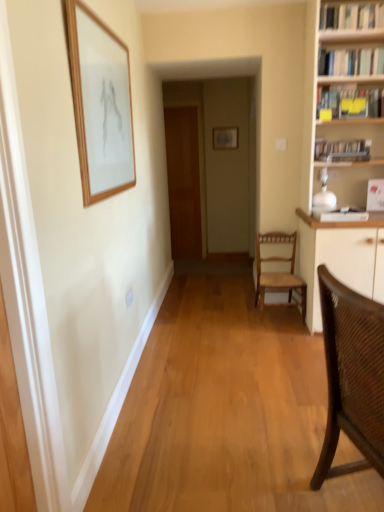
Question: Considering the relative positions of white glossy bookshelf at upper right, which ranks as the fourth book in bottom-to-top order, and brown woven chair at right, which ranks as the 1th chair in front-to-back order, in the image provided, is white glossy bookshelf at upper right, which ranks as the fourth book in bottom-to-top order, to the right of brown woven chair at right, which ranks as the 1th chair in front-to-back order, from the viewer's perspective?

Choices:
 (A) yes
 (B) no

Answer: (A)

Question: Is white glossy bookshelf at upper right, which ranks as the fourth book in bottom-to-top order, oriented away from brown woven chair at right, the second chair viewed from the back?

Choices:
 (A) yes
 (B) no

Answer: (B)

Question: Does white glossy bookshelf at upper right, which ranks as the fourth book in bottom-to-top order, have a lesser height compared to brown woven chair at right, the second chair viewed from the back?

Choices:
 (A) no
 (B) yes

Answer: (B)

Question: Is white glossy bookshelf at upper right, which ranks as the fourth book in bottom-to-top order, thinner than brown woven chair at right, the second chair viewed from the back?

Choices:
 (A) no
 (B) yes

Answer: (B)

Question: Can you confirm if white glossy bookshelf at upper right, which appears as the first book when viewed from the top, is positioned to the left of brown woven chair at right, the second chair viewed from the back?

Choices:
 (A) yes
 (B) no

Answer: (B)

Question: From the image's perspective, is white glossy bookshelf at upper right, which appears as the first book when viewed from the top, over brown woven chair at right, which ranks as the 1th chair in front-to-back order?

Choices:
 (A) yes
 (B) no

Answer: (A)

Question: Is white glossy bookshelf at upper right, which ranks as the 3th book in bottom-to-top order, a part of brown woven chair at right, which ranks as the 1th chair in front-to-back order?

Choices:
 (A) yes
 (B) no

Answer: (B)

Question: Is brown woven chair at right, which ranks as the 1th chair in front-to-back order, positioned far away from white glossy bookshelf at upper right, marked as the second book in a top-to-bottom arrangement?

Choices:
 (A) yes
 (B) no

Answer: (A)

Question: From a real-world perspective, is brown woven chair at right, the second chair viewed from the back, on top of white glossy bookshelf at upper right, marked as the second book in a top-to-bottom arrangement?

Choices:
 (A) no
 (B) yes

Answer: (A)

Question: Is brown woven chair at right, which ranks as the 1th chair in front-to-back order, bigger than white glossy bookshelf at upper right, which ranks as the 3th book in bottom-to-top order?

Choices:
 (A) yes
 (B) no

Answer: (A)

Question: Is brown woven chair at right, which ranks as the 1th chair in front-to-back order, shorter than white glossy bookshelf at upper right, which ranks as the 3th book in bottom-to-top order?

Choices:
 (A) yes
 (B) no

Answer: (B)

Question: Can you confirm if brown woven chair at right, the second chair viewed from the back, is positioned to the right of white glossy bookshelf at upper right, marked as the second book in a top-to-bottom arrangement?

Choices:
 (A) yes
 (B) no

Answer: (B)

Question: Is hardcover books at upper right, acting as the 1th book starting from the bottom, at the right side of brown woven chair at right, the second chair viewed from the back?

Choices:
 (A) yes
 (B) no

Answer: (A)